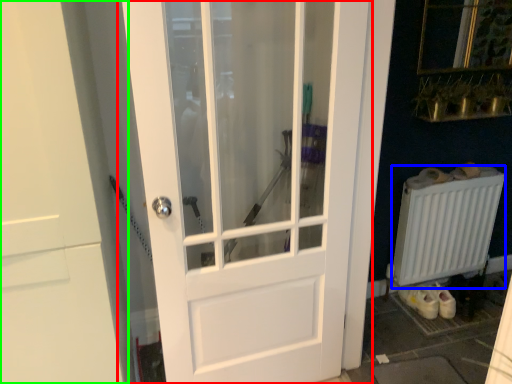
Question: Which object is positioned closest to door (highlighted by a red box)? Select from radiator (highlighted by a blue box) and door (highlighted by a green box).

Choices:
 (A) radiator
 (B) door

Answer: (B)